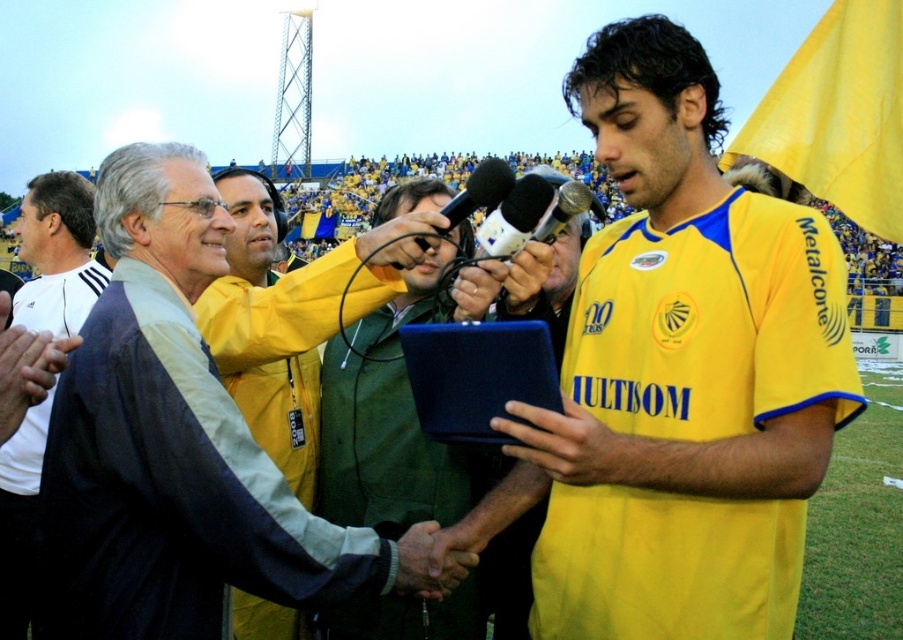
Question: Is white fabric shirt at center to the right of metallic microphones at center from the viewer's perspective?

Choices:
 (A) yes
 (B) no

Answer: (B)

Question: Is light blue fabric jacket at center positioned in front of green fabric jacket at center?

Choices:
 (A) no
 (B) yes

Answer: (B)

Question: Which of the following is the farthest from the observer?

Choices:
 (A) (356, 577)
 (B) (15, 449)
 (C) (374, 502)

Answer: (B)

Question: Which point appears closest to the camera in this image?

Choices:
 (A) (492, 164)
 (B) (520, 224)
 (C) (240, 442)

Answer: (C)

Question: Among these points, which one is farthest from the camera?

Choices:
 (A) (x=454, y=216)
 (B) (x=350, y=369)
 (C) (x=731, y=193)
 (D) (x=219, y=484)

Answer: (B)

Question: Is yellow jersey at center behind white plastic microphone at center?

Choices:
 (A) yes
 (B) no

Answer: (B)